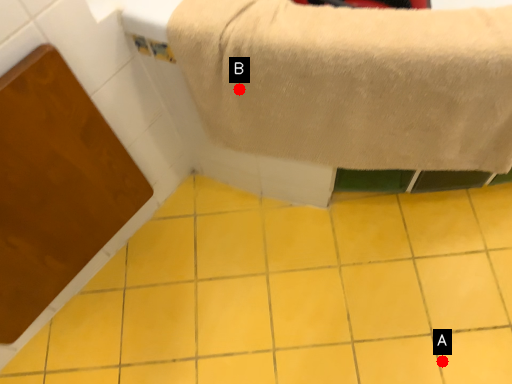
Question: Two points are circled on the image, labeled by A and B beside each circle. Which point is further to the camera?

Choices:
 (A) A is further
 (B) B is further

Answer: (A)